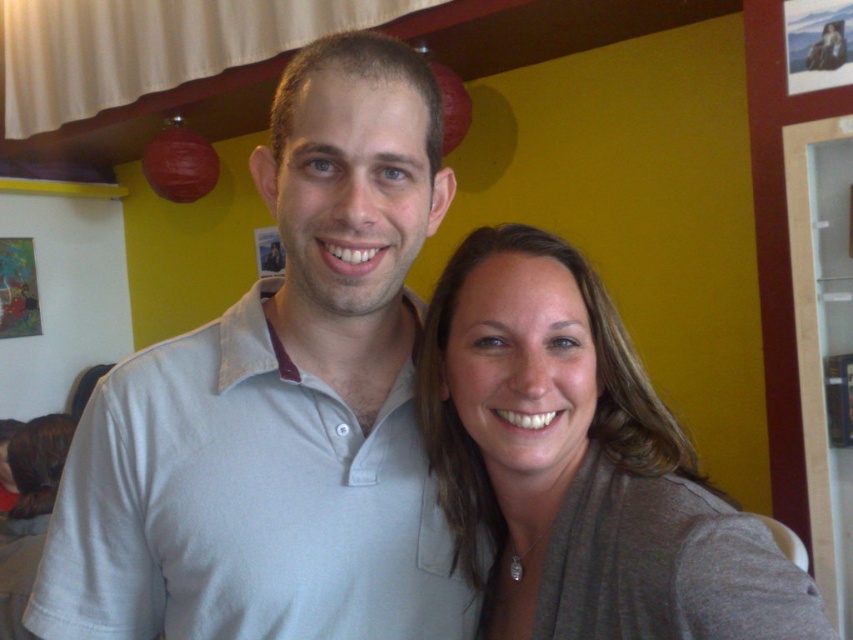
Is light gray cotton polo shirt at center taller than matte gray scarf at right?

Indeed, light gray cotton polo shirt at center has a greater height compared to matte gray scarf at right.

Between light gray cotton polo shirt at center and matte gray scarf at right, which one appears on the left side from the viewer's perspective?

From the viewer's perspective, light gray cotton polo shirt at center appears more on the left side.

The height and width of the screenshot is (640, 853). I want to click on light gray cotton polo shirt at center, so click(280, 404).